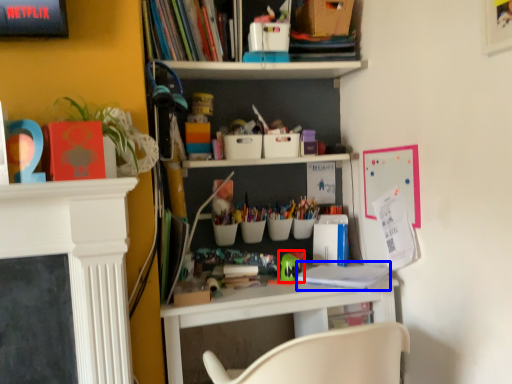
Question: Which of the following is the farthest to the observer, toy (highlighted by a red box) or book (highlighted by a blue box)?

Choices:
 (A) toy
 (B) book

Answer: (A)